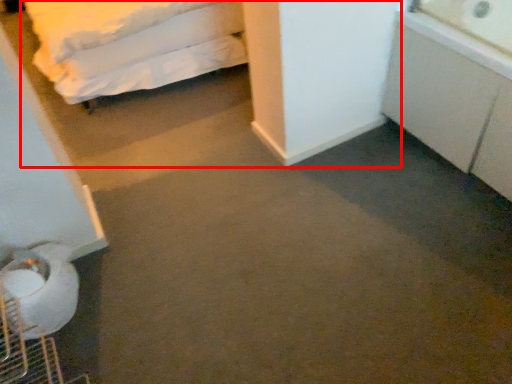
Question: From the image, what is the correct spatial relationship of bed (annotated by the red box) in relation to cabinetry?

Choices:
 (A) left
 (B) right

Answer: (A)